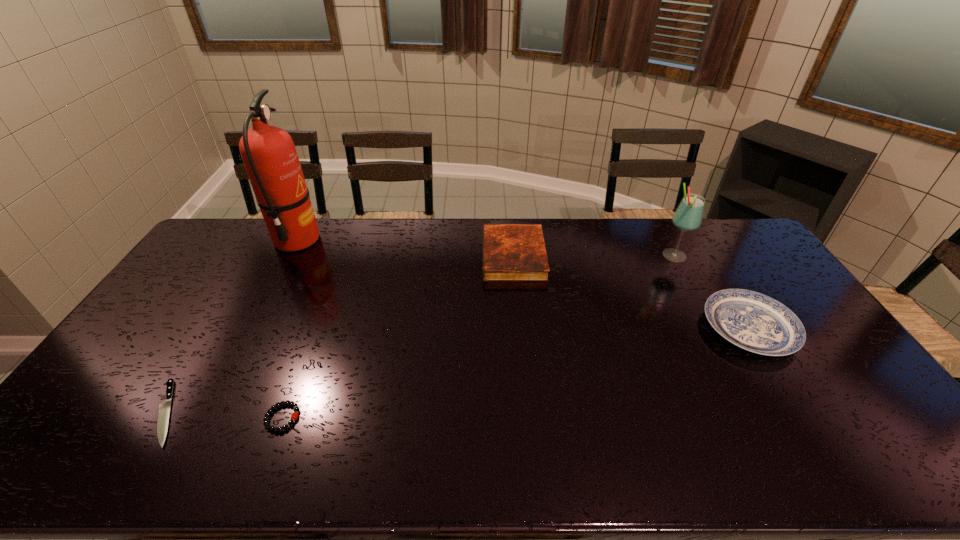
Locate an element on the screen. the tallest object is located at coordinates (269, 155).

Locate an element on the screen. The width and height of the screenshot is (960, 540). the second tallest object is located at coordinates (688, 216).

Find the location of a particular element. the fourth object from left to right is located at coordinates (511, 252).

At what (x,y) coordinates should I click in order to perform the action: click on the third nearest object. Please return your answer as a coordinate pair (x, y). This screenshot has width=960, height=540. Looking at the image, I should click on (x=755, y=322).

Find the location of `the fourth object from right to left`. the fourth object from right to left is located at coordinates (294, 416).

The width and height of the screenshot is (960, 540). Identify the location of bracelet. (294, 416).

Identify the location of steak knife. The image size is (960, 540). (164, 408).

This screenshot has width=960, height=540. Find the location of `vacant space situated 0.220m on the side of the tallest object with the nozzle and handle`. vacant space situated 0.220m on the side of the tallest object with the nozzle and handle is located at coordinates (378, 240).

You are a GUI agent. You are given a task and a screenshot of the screen. Output one action in this format:
    pyautogui.click(x=<x>, y=<y>)
    Task: Click on the free space located on the front of the fifth shortest object
    Image resolution: width=960 pixels, height=540 pixels.
    Given the screenshot: What is the action you would take?
    pyautogui.click(x=723, y=347)

You are a GUI agent. You are given a task and a screenshot of the screen. Output one action in this format:
    pyautogui.click(x=<x>, y=<y>)
    Task: Click on the vacant position located 0.360m on the spine side of the fourth object from left to right
    The height and width of the screenshot is (540, 960).
    Given the screenshot: What is the action you would take?
    pyautogui.click(x=383, y=256)